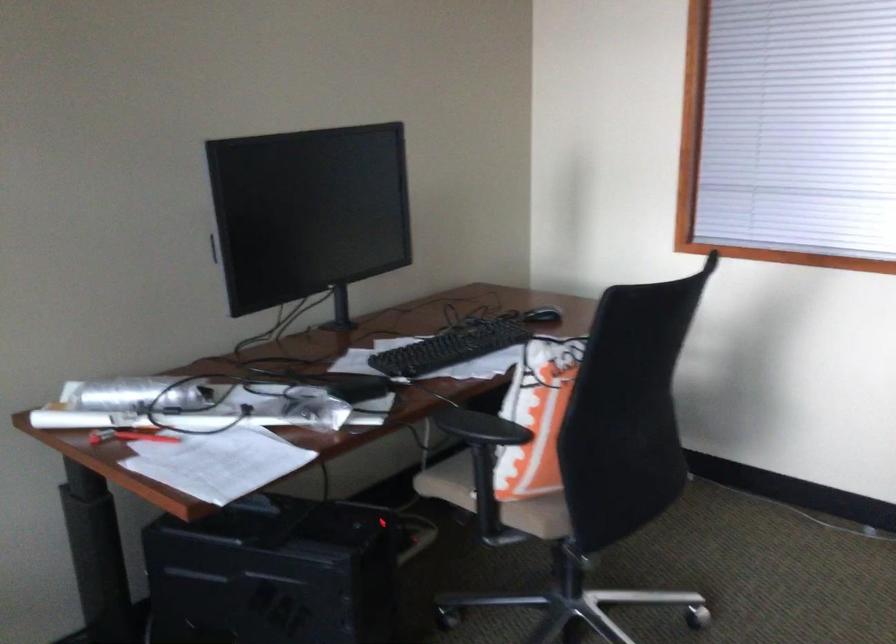
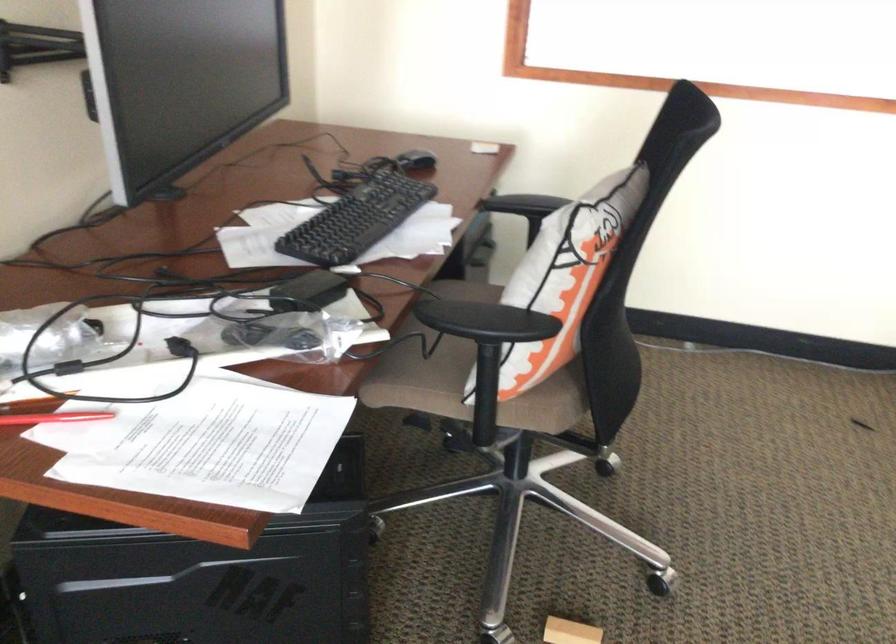
In the second image, find the point that corresponds to (533,513) in the first image.

(543, 408)